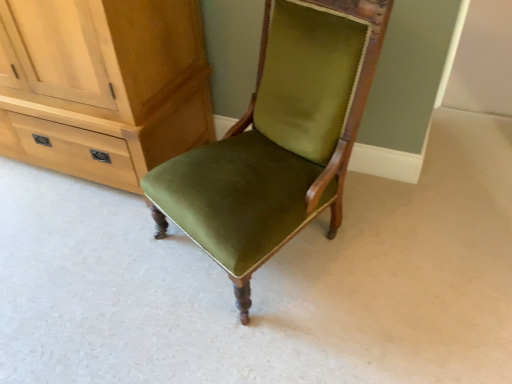
This screenshot has height=384, width=512. What are the coordinates of `free spot to the left of velvet green chair at center` in the screenshot? It's located at (103, 274).